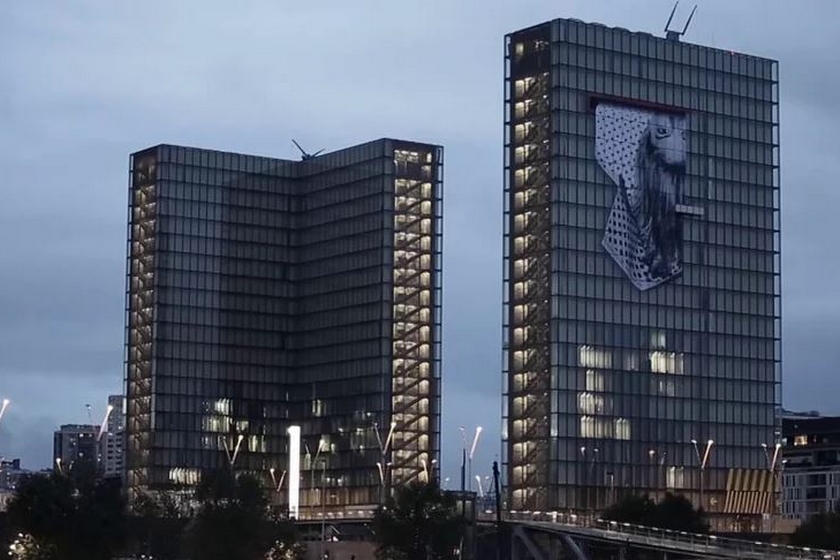
Identify the location of window. (428, 230).